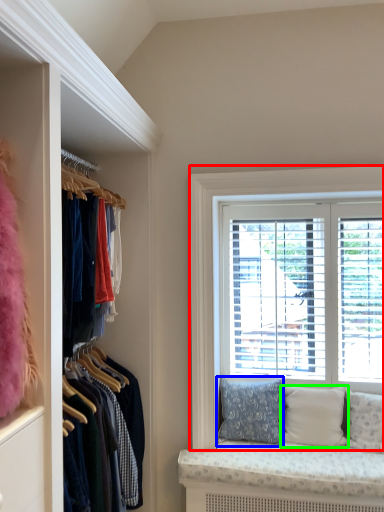
Question: Which object is positioned farthest from window (highlighted by a red box)? Select from pillow (highlighted by a blue box) and pillow (highlighted by a green box).

Choices:
 (A) pillow
 (B) pillow

Answer: (B)